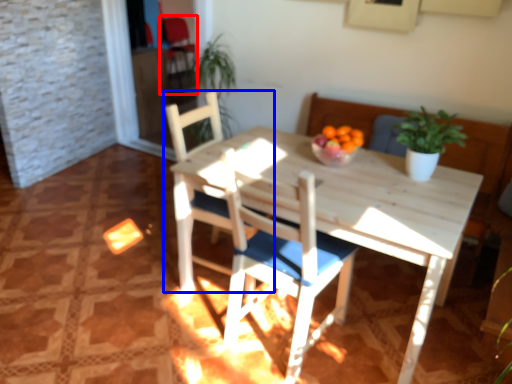
Question: Which object is closer to the camera taking this photo, armchair (highlighted by a red box) or chair (highlighted by a blue box)?

Choices:
 (A) armchair
 (B) chair

Answer: (B)